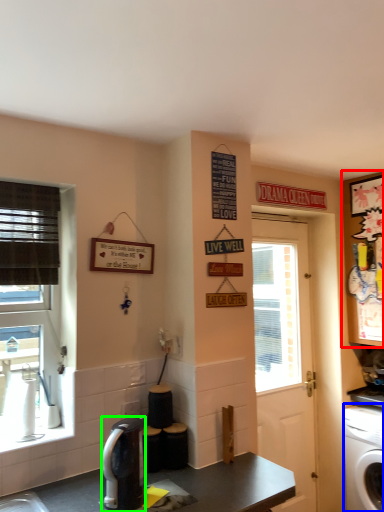
Question: Which object is the farthest from cabinetry (highlighted by a red box)? Choose among these: washing machine (highlighted by a blue box) or coffee maker (highlighted by a green box).

Choices:
 (A) washing machine
 (B) coffee maker

Answer: (B)